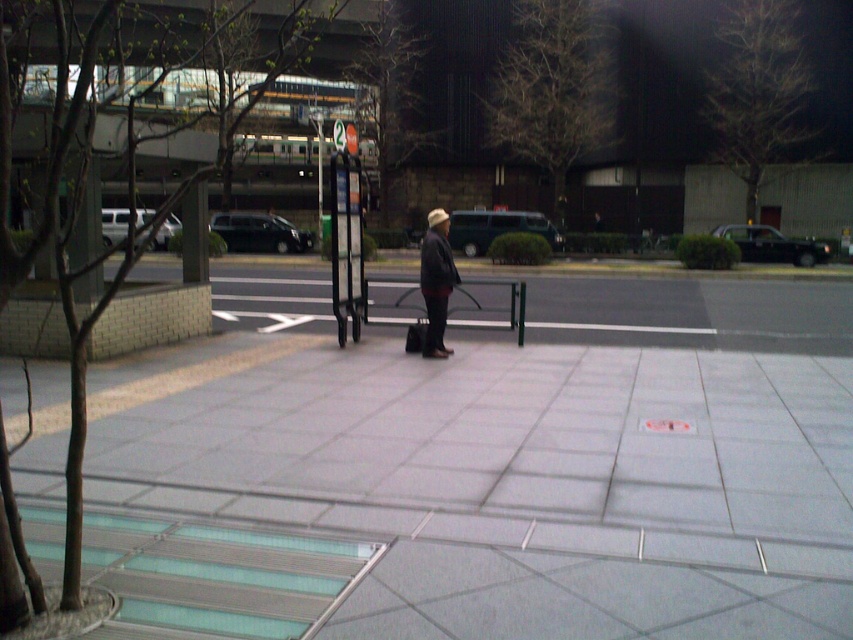
You are at the bus stop and need to walk to the gray tile pavement at center. What are the coordinates you should head towards?

The gray tile pavement at center is located at coordinates point (471,493).

You are at the bus stop and want to know which of the two points, point (45, 456) or point (421, 278), is closer to you. Based on the scene description, which point is nearer?

Point (45, 456) is closer to the viewer than point (421, 278).